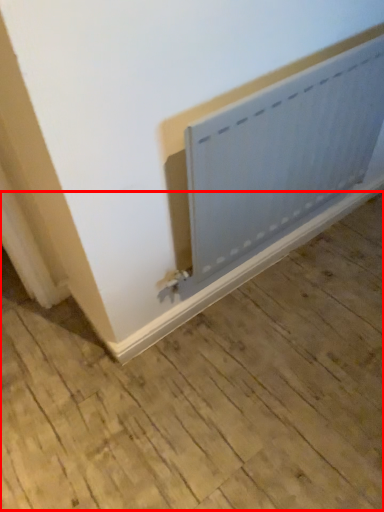
Question: In this image, where is plywood (annotated by the red box) located relative to radiator?

Choices:
 (A) right
 (B) left

Answer: (B)